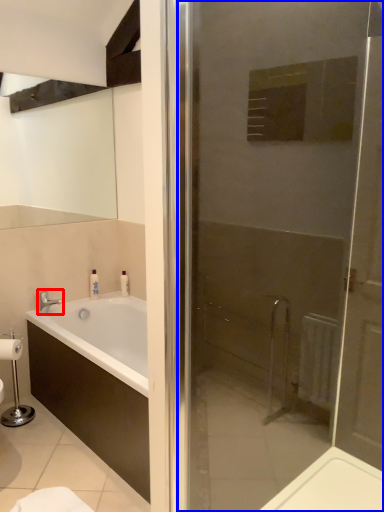
Question: Which object appears farthest to the camera in this image, tap (highlighted by a red box) or door (highlighted by a blue box)?

Choices:
 (A) tap
 (B) door

Answer: (A)